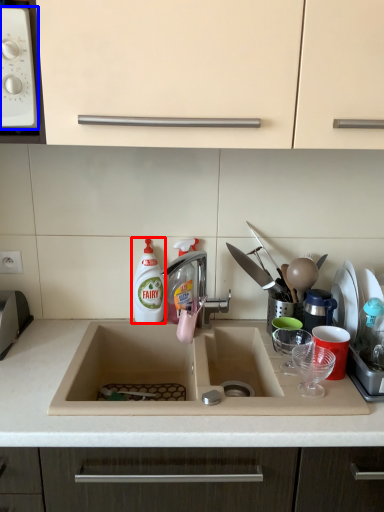
Question: Which point is further to the camera, cleaning product (highlighted by a red box) or home appliance (highlighted by a blue box)?

Choices:
 (A) cleaning product
 (B) home appliance

Answer: (A)